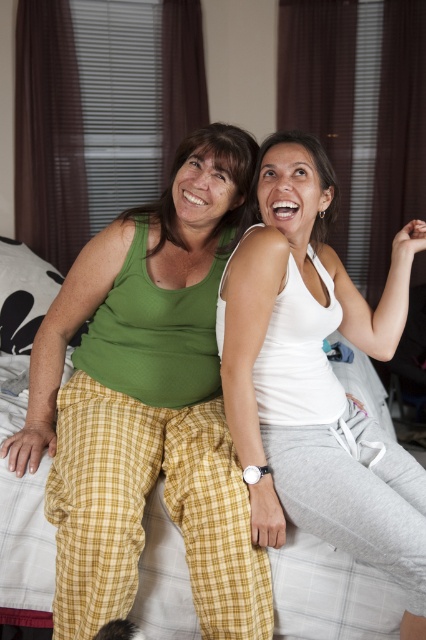
Question: Is green cotton tank top at center further to the viewer compared to white matte tank top at center?

Choices:
 (A) no
 (B) yes

Answer: (B)

Question: Does green cotton tank top at center have a greater width compared to white matte tank top at center?

Choices:
 (A) no
 (B) yes

Answer: (B)

Question: Does green cotton tank top at center have a lesser width compared to white matte tank top at center?

Choices:
 (A) no
 (B) yes

Answer: (A)